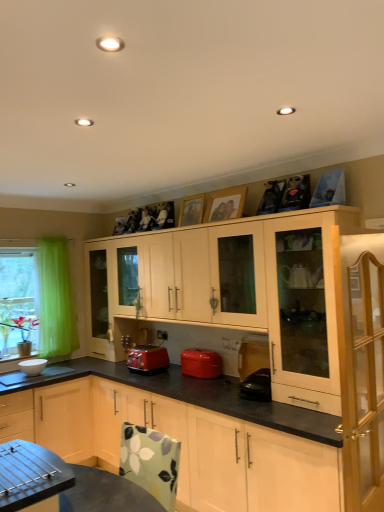
Measure the distance between point (360, 508) and camera.

Point (360, 508) is 6.50 feet from camera.

Where is `white glossy bowl at lower left, the first appliance viewed from the back`? white glossy bowl at lower left, the first appliance viewed from the back is located at coordinates (32, 366).

Measure the distance between point (141, 365) and camera.

3.49 meters.

What do you see at coordinates (34, 376) in the screenshot? I see `white glossy bowl at lower left` at bounding box center [34, 376].

Identify the location of light wood cabinet at right, which appears as the third cabinetry when viewed from the back. (361, 372).

Would you say green sheer curtain at left is to the left or to the right of floral fabric table at lower left in the picture?

In the image, green sheer curtain at left appears on the left side of floral fabric table at lower left.

Does green sheer curtain at left have a smaller size compared to floral fabric table at lower left?

Correct, green sheer curtain at left occupies less space than floral fabric table at lower left.

Consider the image. From the image's perspective, who appears lower, green sheer curtain at left or floral fabric table at lower left?

floral fabric table at lower left appears lower in the image.

From a real-world perspective, between matte red toaster at center, arranged as the second kitchen appliance when viewed from the left, and matte red toaster at center, the first kitchen appliance from the left, who is vertically higher?

In real-world perspective, matte red toaster at center, the first kitchen appliance from the left, is above.

Is matte red toaster at center, arranged as the second kitchen appliance when viewed from the left, turned away from matte red toaster at center, the second kitchen appliance when ordered from right to left?

matte red toaster at center, arranged as the second kitchen appliance when viewed from the left, is not turned away from matte red toaster at center, the second kitchen appliance when ordered from right to left.

From the image's perspective, would you say matte red toaster at center, arranged as the second kitchen appliance when viewed from the left, is shown under matte red toaster at center, the first kitchen appliance from the left?

No.

Is matte red toaster at center, arranged as the second kitchen appliance when viewed from the left, placed right next to matte red toaster at center, the second kitchen appliance when ordered from right to left?

No.

Is matte red toaster at center, the first kitchen appliance from the left, facing away from floral fabric table at lower left?

No, matte red toaster at center, the first kitchen appliance from the left, is not facing the opposite direction of floral fabric table at lower left.

Considering the sizes of objects matte red toaster at center, the second kitchen appliance when ordered from right to left, and floral fabric table at lower left in the image provided, who is bigger, matte red toaster at center, the second kitchen appliance when ordered from right to left, or floral fabric table at lower left?

With larger size is floral fabric table at lower left.

Between matte red toaster at center, the first kitchen appliance from the left, and floral fabric table at lower left, which one has smaller width?

matte red toaster at center, the first kitchen appliance from the left.

Considering the positions of points (133, 357) and (47, 471), is point (133, 357) closer to camera compared to point (47, 471)?

No, it is not.

Visually, is matte red toaster at center, the second kitchen appliance when ordered from right to left, positioned to the left or to the right of matte red toaster at center, placed as the first kitchen appliance when sorted from right to left?

In the image, matte red toaster at center, the second kitchen appliance when ordered from right to left, appears on the left side of matte red toaster at center, placed as the first kitchen appliance when sorted from right to left.

Does matte red toaster at center, the first kitchen appliance from the left, have a larger size compared to matte red toaster at center, placed as the first kitchen appliance when sorted from right to left?

No, matte red toaster at center, the first kitchen appliance from the left, is not bigger than matte red toaster at center, placed as the first kitchen appliance when sorted from right to left.

Considering the sizes of objects matte red toaster at center, the first kitchen appliance from the left, and matte red toaster at center, placed as the first kitchen appliance when sorted from right to left, in the image provided, who is shorter, matte red toaster at center, the first kitchen appliance from the left, or matte red toaster at center, placed as the first kitchen appliance when sorted from right to left,?

With less height is matte red toaster at center, placed as the first kitchen appliance when sorted from right to left.

Consider the image. Is matte red toaster at center, the second kitchen appliance when ordered from right to left, positioned far away from matte red toaster at center, placed as the first kitchen appliance when sorted from right to left?

matte red toaster at center, the second kitchen appliance when ordered from right to left, is near matte red toaster at center, placed as the first kitchen appliance when sorted from right to left, not far away.

Is matte black kettle at lower center, acting as the 2th appliance starting from the back, behind light wood cabinet at right, positioned as the 1th cabinetry in front-to-back order?

Yes, matte black kettle at lower center, acting as the 2th appliance starting from the back, is further from the camera.

What's the angular difference between matte black kettle at lower center, acting as the 2th appliance starting from the back, and light wood cabinet at right, which appears as the third cabinetry when viewed from the back,'s facing directions?

93.3 degrees.

From a real-world perspective, who is located higher, matte black kettle at lower center, the first appliance from the front, or light wood cabinet at right, which appears as the third cabinetry when viewed from the back?

In real-world perspective, light wood cabinet at right, which appears as the third cabinetry when viewed from the back, is above.

Would you consider matte black kettle at lower center, the second appliance when ordered from left to right, to be distant from light wood cabinet at right, positioned as the 1th cabinetry in front-to-back order?

Yes, matte black kettle at lower center, the second appliance when ordered from left to right, is far from light wood cabinet at right, positioned as the 1th cabinetry in front-to-back order.

Looking at their sizes, would you say floral fabric table at lower left is wider or thinner than light wood cabinet at upper right, placed as the third cabinetry when sorted from front to back?

Clearly, floral fabric table at lower left has more width compared to light wood cabinet at upper right, placed as the third cabinetry when sorted from front to back.

Is floral fabric table at lower left positioned behind light wood cabinet at upper right, the 1th cabinetry in the back-to-front sequence?

No, floral fabric table at lower left is closer to the viewer.

Is light wood cabinet at upper right, the 1th cabinetry in the back-to-front sequence, completely or partially inside floral fabric table at lower left?

No, light wood cabinet at upper right, the 1th cabinetry in the back-to-front sequence, is not inside floral fabric table at lower left.

From the image's perspective, is white glossy bowl at lower left, marked as the second appliance in a right-to-left arrangement, positioned above or below matte red toaster at center, the second kitchen appliance when ordered from right to left?

From the image's perspective, white glossy bowl at lower left, marked as the second appliance in a right-to-left arrangement, appears below matte red toaster at center, the second kitchen appliance when ordered from right to left.

Which object is wider, white glossy bowl at lower left, marked as the second appliance in a right-to-left arrangement, or matte red toaster at center, the first kitchen appliance from the left?

matte red toaster at center, the first kitchen appliance from the left.

Are white glossy bowl at lower left, marked as the second appliance in a right-to-left arrangement, and matte red toaster at center, the second kitchen appliance when ordered from right to left, beside each other?

They are not placed beside each other.

The width and height of the screenshot is (384, 512). In order to click on table that is on the right side of green sheer curtain at left in this screenshot , I will do `click(64, 483)`.

Identify the location of kitchen appliance in front of the matte red toaster at center, the first kitchen appliance from the left. This screenshot has height=512, width=384. (201, 362).

Looking at the image, which one is located closer to matte black kettle at lower center, the second appliance when ordered from left to right, light wood cabinet at right, positioned as the 1th cabinetry in front-to-back order, or white glossy bowl at lower left, marked as the second appliance in a right-to-left arrangement?

Among the two, light wood cabinet at right, positioned as the 1th cabinetry in front-to-back order, is located nearer to matte black kettle at lower center, the second appliance when ordered from left to right.

In the scene shown: Estimate the real-world distances between objects in this image. Which object is further from light wood cabinet at right, which appears as the third cabinetry when viewed from the back, matte red toaster at center, placed as the first kitchen appliance when sorted from right to left, or green sheer curtain at left?

Among the two, green sheer curtain at left is located further to light wood cabinet at right, which appears as the third cabinetry when viewed from the back.

Looking at the image, which one is located closer to matte red toaster at center, the first kitchen appliance from the left, matte red toaster at center, arranged as the second kitchen appliance when viewed from the left, or floral fabric table at lower left?

matte red toaster at center, arranged as the second kitchen appliance when viewed from the left.

Based on their spatial positions, is white glossy bowl at lower left, the second appliance from the front, or light wood cabinet at upper right, placed as the third cabinetry when sorted from front to back, closer to light wood cabinet at center, placed as the second cabinetry when sorted from back to front?

Among the two, light wood cabinet at upper right, placed as the third cabinetry when sorted from front to back, is located nearer to light wood cabinet at center, placed as the second cabinetry when sorted from back to front.

Considering their positions, is light wood cabinet at center, positioned as the second cabinetry in front-to-back order, positioned further to white glossy bowl at lower left, the first appliance viewed from the back, than green sheer curtain at left?

light wood cabinet at center, positioned as the second cabinetry in front-to-back order.

In the scene shown: When comparing their distances from matte black kettle at lower center, the first appliance from the front, does matte red toaster at center, placed as the first kitchen appliance when sorted from right to left, or white glossy bowl at lower left, the first appliance viewed from the back, seem further?

The object further to matte black kettle at lower center, the first appliance from the front, is white glossy bowl at lower left, the first appliance viewed from the back.

Based on their spatial positions, is matte red toaster at center, the second kitchen appliance when ordered from right to left, or floral fabric table at lower left further from white glossy bowl at lower left, the first appliance viewed from the back?

floral fabric table at lower left lies further to white glossy bowl at lower left, the first appliance viewed from the back, than the other object.

Looking at the image, which one is located further to matte red toaster at center, arranged as the second kitchen appliance when viewed from the left, floral fabric table at lower left or white glossy bowl at lower left?

Based on the image, floral fabric table at lower left appears to be further to matte red toaster at center, arranged as the second kitchen appliance when viewed from the left.

This screenshot has height=512, width=384. Identify the location of table located between white glossy bowl at lower left, marked as the first appliance in a left-to-right arrangement, and light wood cabinet at right, which appears as the third cabinetry when viewed from the back, in the left-right direction. (64, 483).

The width and height of the screenshot is (384, 512). Find the location of `appliance between green sheer curtain at left and matte red toaster at center, arranged as the second kitchen appliance when viewed from the left, in the horizontal direction`. appliance between green sheer curtain at left and matte red toaster at center, arranged as the second kitchen appliance when viewed from the left, in the horizontal direction is located at coordinates (32, 366).

In order to click on appliance between light wood cabinet at right, which appears as the third cabinetry when viewed from the back, and matte red toaster at center, arranged as the second kitchen appliance when viewed from the left, along the z-axis in this screenshot , I will do `click(253, 354)`.

I want to click on cabinetry between green sheer curtain at left and matte red toaster at center, placed as the first kitchen appliance when sorted from right to left, in the horizontal direction, so click(x=190, y=447).